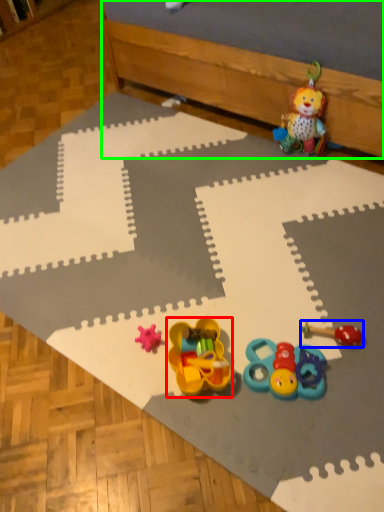
Question: Which object is positioned closest to toy (highlighted by a red box)? Select from toy (highlighted by a blue box) and bed frame (highlighted by a green box).

Choices:
 (A) toy
 (B) bed frame

Answer: (A)